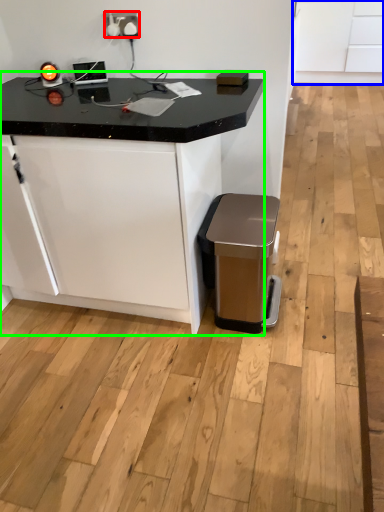
Question: Estimate the real-world distances between objects in this image. Which object is closer to electric outlet (highlighted by a red box), cabinetry (highlighted by a blue box) or table (highlighted by a green box)?

Choices:
 (A) cabinetry
 (B) table

Answer: (B)